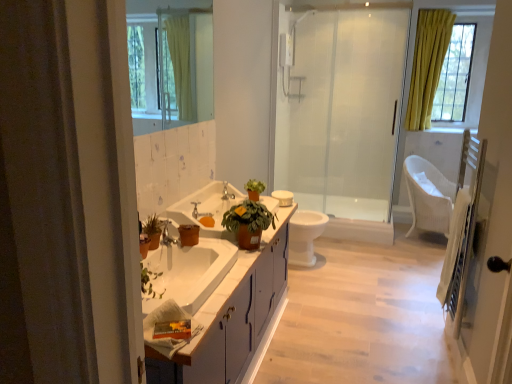
Question: From a real-world perspective, is white glossy sink at center located higher than transparent glass shower door at center?

Choices:
 (A) no
 (B) yes

Answer: (A)

Question: Is white glossy sink at center at the right side of transparent glass shower door at center?

Choices:
 (A) no
 (B) yes

Answer: (A)

Question: Can transparent glass shower door at center be found inside white glossy sink at center?

Choices:
 (A) yes
 (B) no

Answer: (B)

Question: From the image's perspective, is white glossy sink at center located beneath transparent glass shower door at center?

Choices:
 (A) no
 (B) yes

Answer: (B)

Question: Can you confirm if white glossy sink at center is thinner than transparent glass shower door at center?

Choices:
 (A) yes
 (B) no

Answer: (B)

Question: Looking at their shapes, would you say transparent glass shower door at center is wider or thinner than white wooden screen door at right?

Choices:
 (A) thin
 (B) wide

Answer: (A)

Question: Relative to white wooden screen door at right, is transparent glass shower door at center in front or behind?

Choices:
 (A) front
 (B) behind

Answer: (B)

Question: Is point (356, 205) closer or farther from the camera than point (480, 357)?

Choices:
 (A) farther
 (B) closer

Answer: (A)

Question: From a real-world perspective, relative to white wooden screen door at right, is transparent glass shower door at center vertically above or below?

Choices:
 (A) above
 (B) below

Answer: (A)

Question: Is point (503, 107) closer or farther from the camera than point (166, 213)?

Choices:
 (A) closer
 (B) farther

Answer: (A)

Question: From the image's perspective, is white wooden screen door at right above or below white glossy sink at center?

Choices:
 (A) above
 (B) below

Answer: (B)

Question: Is white wooden screen door at right wider or thinner than white glossy sink at center?

Choices:
 (A) thin
 (B) wide

Answer: (A)

Question: From their relative heights in the image, would you say white wooden screen door at right is taller or shorter than white glossy sink at center?

Choices:
 (A) tall
 (B) short

Answer: (A)

Question: From a real-world perspective, is white plastic towel bar at upper center physically located above or below yellow fabric curtain at upper right?

Choices:
 (A) below
 (B) above

Answer: (A)

Question: Is white plastic towel bar at upper center to the left or to the right of yellow fabric curtain at upper right in the image?

Choices:
 (A) left
 (B) right

Answer: (A)